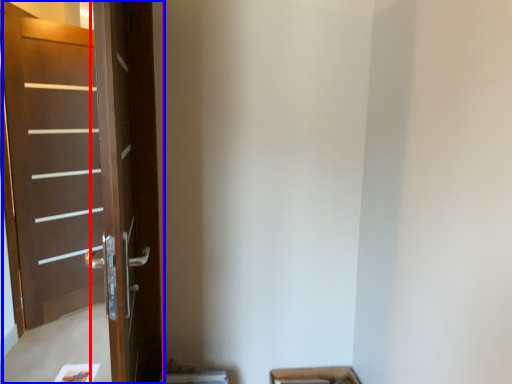
Question: Which of the following is the closest to the observer, screen door (highlighted by a red box) or door (highlighted by a blue box)?

Choices:
 (A) screen door
 (B) door

Answer: (A)